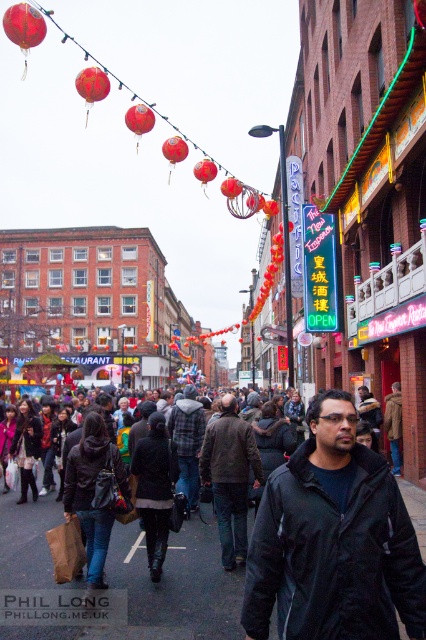
In the scene shown: You are a photographer trying to capture both the matte red lantern at upper center and the red paper lantern at center in a single frame. Considering their sizes, which lantern should you focus on to ensure both fit clearly in the photo?

The matte red lantern at upper center is larger than the red paper lantern at center. To ensure both fit clearly in the photo, focus on the matte red lantern at upper center since it requires more space, and the smaller red paper lantern at center will naturally fit within the frame.

You are standing at the point labeled point (178, 141) and want to walk to the point labeled point (233, 177). Which direction should you move to get closer to your destination?

To move from point (178, 141) to point (233, 177), you should move forward since point (178, 141) is closer to the camera than point (233, 177). Moving forward will take you towards the destination which is further away from the camera.

You are a visitor in Chinatown and notice two red lanterns hanging above the street. The red matte lantern at upper center and the red paper lantern at center. Which one is larger in size?

The red matte lantern at upper center is bigger than the red paper lantern at center.